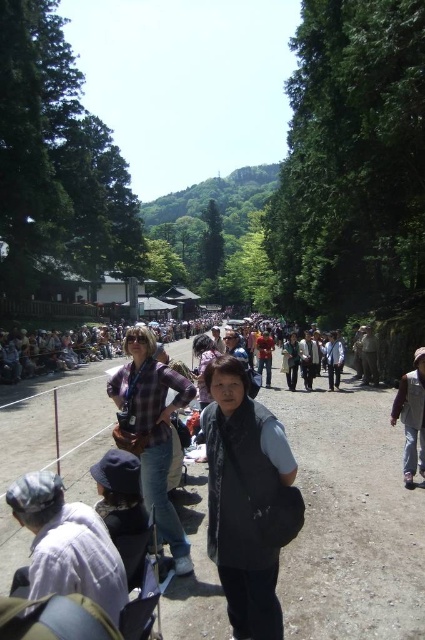
Based on the photo, you are a hiker who needs to reach the light gray fabric hat at lower left from the brown dirt track at center. Given that you can walk 1.5 meters per second, how many seconds will it take you to reach the hat?

The brown dirt track at center is 12.61 meters away from the light gray fabric hat at lower left. At a walking speed of 1.5 meters per second, it would take approximately 8.4 seconds to reach the hat.

You are a photographer standing at the edge of the brown dirt track at center and want to take a photo of the black fabric vest at center. Which object is closer to your camera lens?

The brown dirt track at center is closer to the viewer than the black fabric vest at center, so the dirt track will appear closer in the photo.

You are a photographer trying to capture a photo of the black fabric vest at center and the light gray fabric hat at lower left. If you want to ensure both items are fully visible in the frame without cropping, which item requires more horizontal space in the camera frame?

The black fabric vest at center requires more horizontal space in the camera frame because its width surpasses that of the light gray fabric hat at lower left.